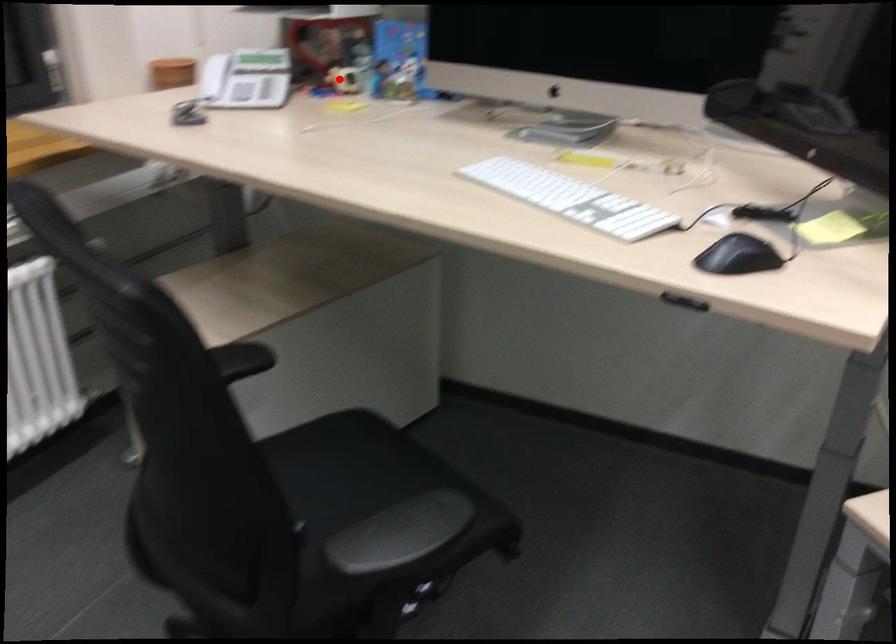
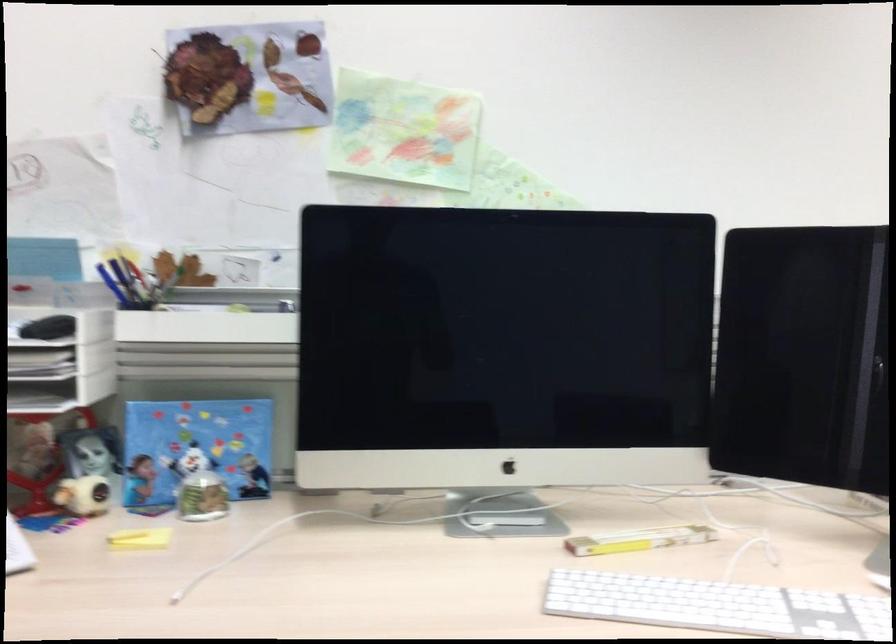
The point at the highlighted location is marked in the first image. Where is the corresponding point in the second image?

(83, 495)